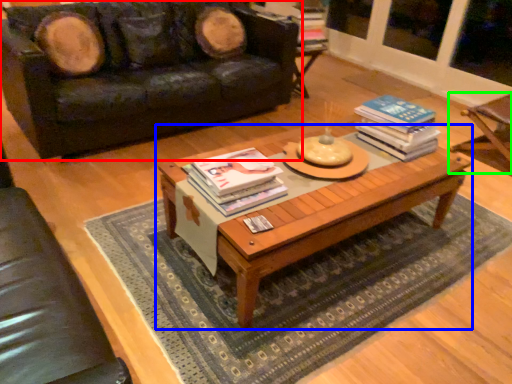
Question: Estimate the real-world distances between objects in this image. Which object is closer to studio couch (highlighted by a red box), coffee table (highlighted by a blue box) or armchair (highlighted by a green box)?

Choices:
 (A) coffee table
 (B) armchair

Answer: (A)